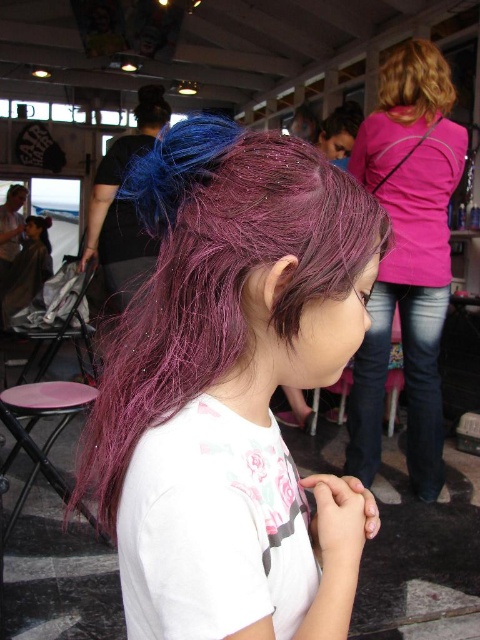
At what (x,y) coordinates should I click in order to perform the action: click on pink plastic stool at lower left. Please return your answer as a coordinate pair (x, y). This screenshot has height=640, width=480. Looking at the image, I should click on (35, 422).

Does point (19, 401) come farther from viewer compared to point (420, 96)?

That is False.

Find the location of a particular element. The width and height of the screenshot is (480, 640). pink plastic stool at lower left is located at coordinates (35, 422).

Identify the location of pink plastic stool at lower left. (35, 422).

Does point (127, 179) come closer to viewer compared to point (423, 374)?

Yes.

Who is more forward, (117, 397) or (427, 480)?

Point (117, 397)

The width and height of the screenshot is (480, 640). I want to click on shiny purple hair at center, so click(x=238, y=358).

Which of these two, shiny purple hair at center or pink plastic stool at lower left, stands shorter?

With less height is pink plastic stool at lower left.

Does shiny purple hair at center have a lesser width compared to pink plastic stool at lower left?

Indeed, shiny purple hair at center has a lesser width compared to pink plastic stool at lower left.

Describe the element at coordinates (238, 358) in the screenshot. I see `shiny purple hair at center` at that location.

Image resolution: width=480 pixels, height=640 pixels. In order to click on shiny purple hair at center in this screenshot , I will do `click(238, 358)`.